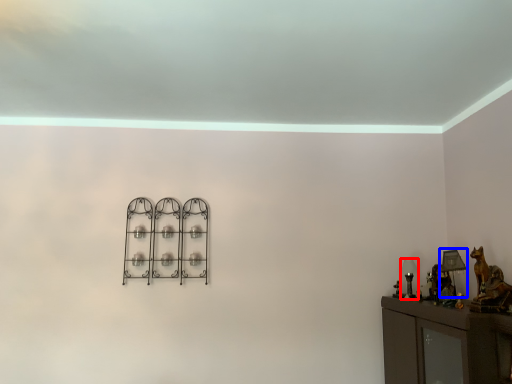
Question: Among these objects, which one is nearest to the camera, table lamp (highlighted by a red box) or table lamp (highlighted by a blue box)?

Choices:
 (A) table lamp
 (B) table lamp

Answer: (B)